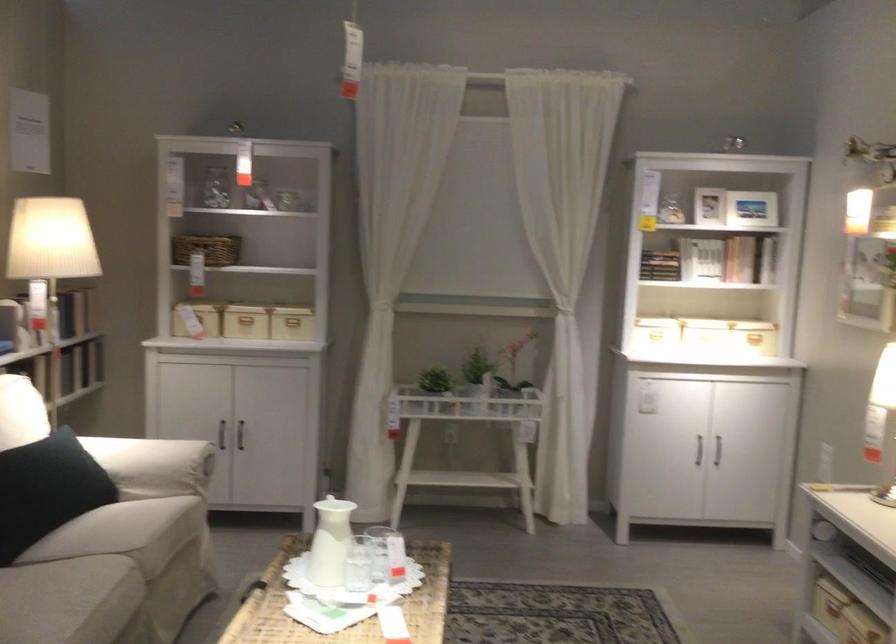
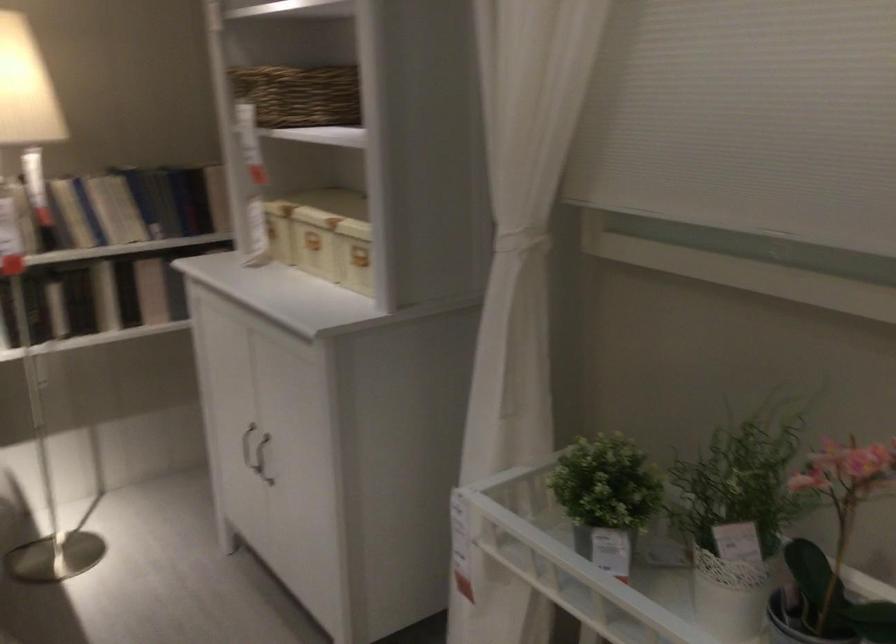
Where in the second image is the point corresponding to point 226,433 from the first image?

(247, 446)